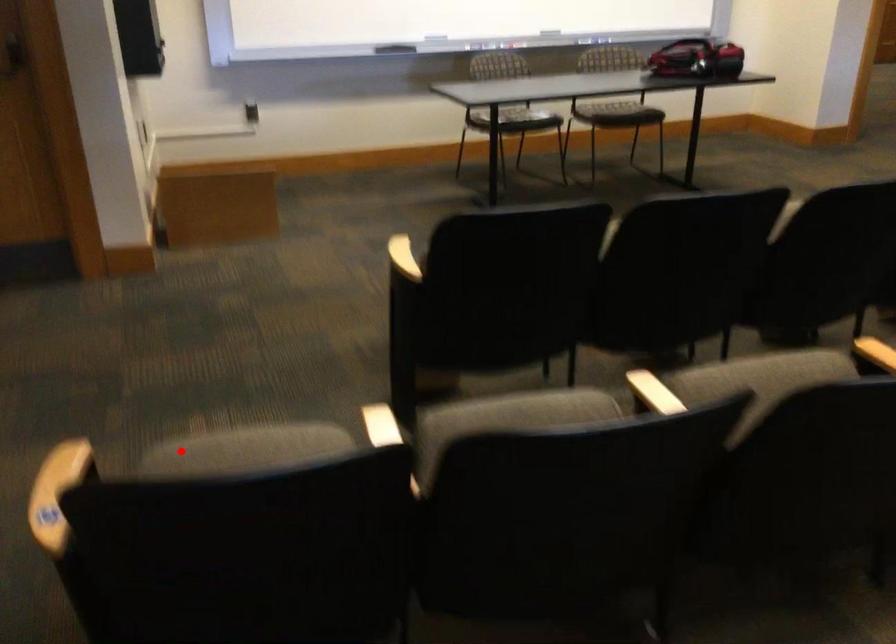
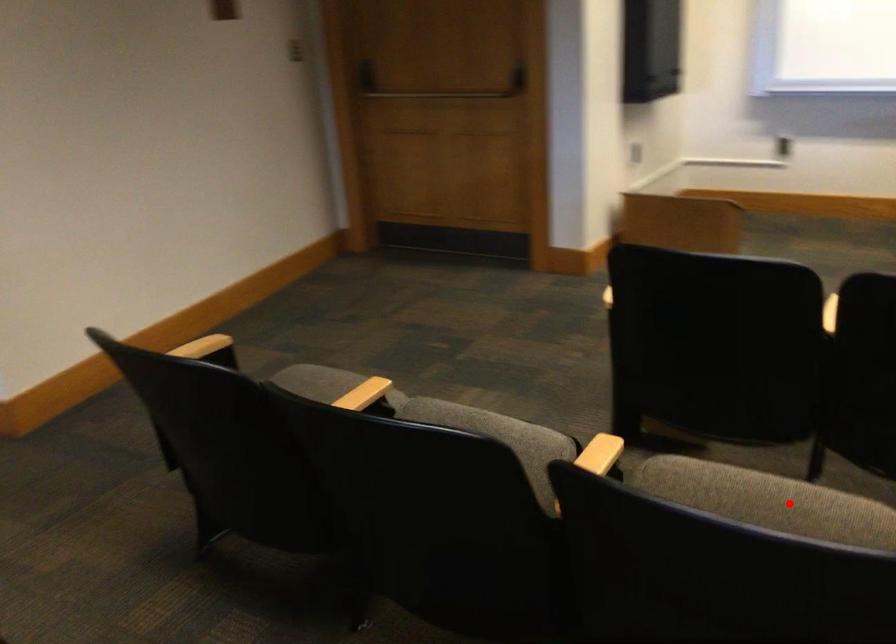
I am providing you with two images of the same scene from different viewpoints. A red point is marked on the first image and another point is marked on the second image. Is the marked point in image1 the same physical position as the marked point in image2?

No